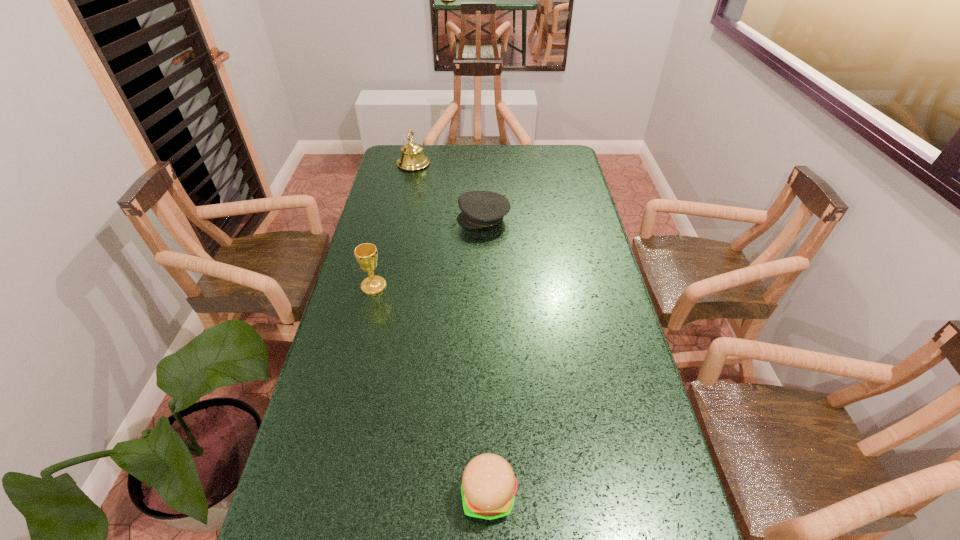
Identify the location of empty space between the beret and the farthest object. Image resolution: width=960 pixels, height=540 pixels. (448, 191).

Find the location of a particular element. Image resolution: width=960 pixels, height=540 pixels. vacant region between the third nearest object and the hamburger is located at coordinates (486, 357).

Image resolution: width=960 pixels, height=540 pixels. In order to click on blank region between the farthest object and the beret in this screenshot , I will do `click(448, 191)`.

Where is `unoccupied position between the farthest object and the third farthest object`? unoccupied position between the farthest object and the third farthest object is located at coordinates (394, 225).

Find the location of `empty space between the hamburger and the farthest object`. empty space between the hamburger and the farthest object is located at coordinates (451, 329).

Where is `free space between the second nearest object and the second farthest object`? This screenshot has width=960, height=540. free space between the second nearest object and the second farthest object is located at coordinates (428, 252).

Identify which object is located as the nearest to the nearest object. Please provide its 2D coordinates. Your answer should be formatted as a tuple, i.e. [(x, y)], where the tuple contains the x and y coordinates of a point satisfying the conditions above.

[(366, 254)]

Identify which object is located as the second nearest to the beret. Please provide its 2D coordinates. Your answer should be formatted as a tuple, i.e. [(x, y)], where the tuple contains the x and y coordinates of a point satisfying the conditions above.

[(366, 254)]

Identify the location of free space that satisfies the following two spatial constraints: 1. on the back side of the third farthest object; 2. on the left side of the farthest object. (403, 164).

The width and height of the screenshot is (960, 540). I want to click on free space in the image that satisfies the following two spatial constraints: 1. on the back side of the chalice; 2. on the right side of the farthest object, so click(403, 164).